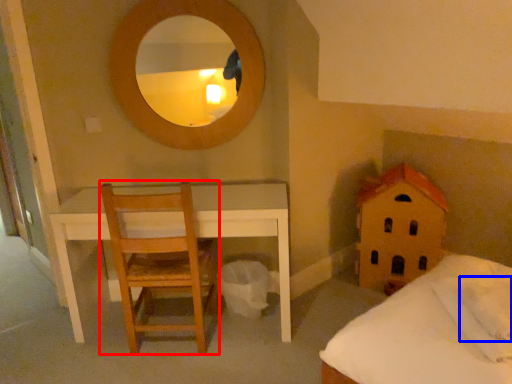
Question: Which of the following is the closest to the observer, chair (highlighted by a red box) or pillow (highlighted by a blue box)?

Choices:
 (A) chair
 (B) pillow

Answer: (B)